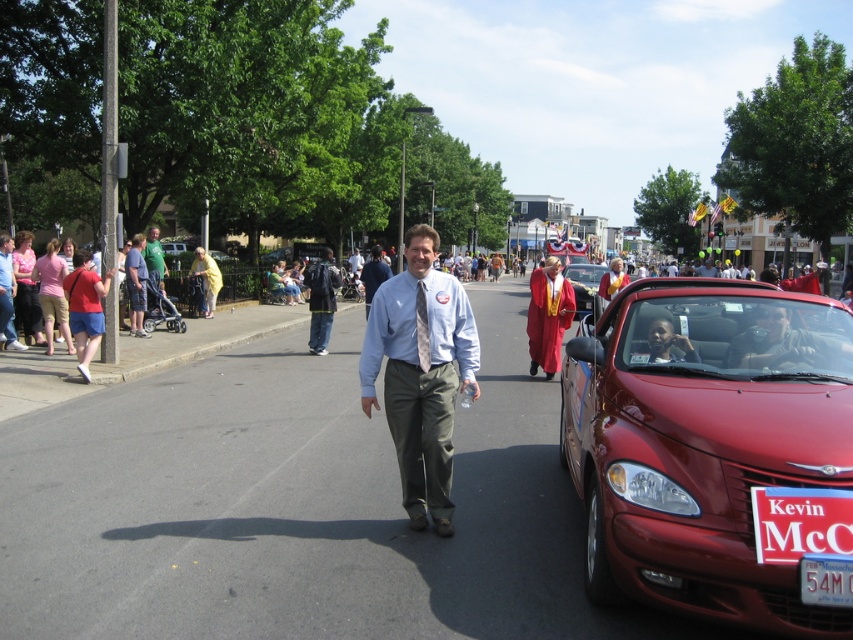
Is metallic blue license plate at center shorter than metallic silver stroller at left?

Indeed, metallic blue license plate at center has a lesser height compared to metallic silver stroller at left.

How much distance is there between metallic blue license plate at center and metallic silver stroller at left?

metallic blue license plate at center is 14.40 meters from metallic silver stroller at left.

Describe the element at coordinates (827, 579) in the screenshot. This screenshot has height=640, width=853. I see `metallic blue license plate at center` at that location.

The width and height of the screenshot is (853, 640). I want to click on metallic blue license plate at center, so click(827, 579).

Can you confirm if white plastic license plate at lower right is bigger than red velvet gown at center?

Incorrect, white plastic license plate at lower right is not larger than red velvet gown at center.

Between point (790, 532) and point (532, 314), which one is positioned behind?

Point (532, 314)

Who is more distant from viewer, (825, 525) or (538, 310)?

The point (538, 310) is behind.

At what (x,y) coordinates should I click in order to perform the action: click on white plastic license plate at lower right. Please return your answer as a coordinate pair (x, y). Image resolution: width=853 pixels, height=640 pixels. Looking at the image, I should click on (799, 522).

Based on the photo, does shiny red convertible at center have a lesser height compared to yellow fabric at left?

Result: Indeed, shiny red convertible at center has a lesser height compared to yellow fabric at left.

Where is `shiny red convertible at center`? Image resolution: width=853 pixels, height=640 pixels. shiny red convertible at center is located at coordinates (712, 451).

Between point (660, 522) and point (213, 278), which one is positioned behind?

Point (213, 278)

In order to click on shiny red convertible at center in this screenshot , I will do `click(712, 451)`.